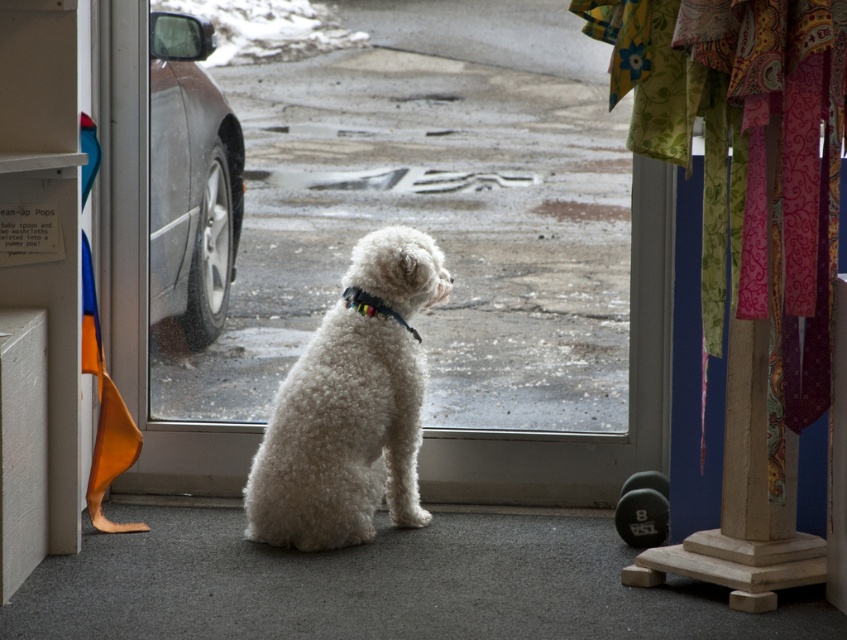
How much distance is there between transparent glass door at center and multicolored fabric neckband at center?

16.41 inches

Does transparent glass door at center appear under multicolored fabric neckband at center?

Correct, transparent glass door at center is located below multicolored fabric neckband at center.

In order to click on transparent glass door at center in this screenshot , I will do `click(582, 433)`.

Who is positioned more to the left, white fluffy dog at center or transparent glass door at center?

white fluffy dog at center is more to the left.

Image resolution: width=847 pixels, height=640 pixels. In order to click on white fluffy dog at center in this screenshot , I will do `click(352, 404)`.

Where is `white fluffy dog at center`? white fluffy dog at center is located at coordinates (352, 404).

Consider the image. Who is shorter, white fluffy dog at center or shiny metallic car at left?

white fluffy dog at center is shorter.

Which is behind, point (322, 424) or point (184, 209)?

Positioned behind is point (184, 209).

The height and width of the screenshot is (640, 847). Identify the location of white fluffy dog at center. (352, 404).